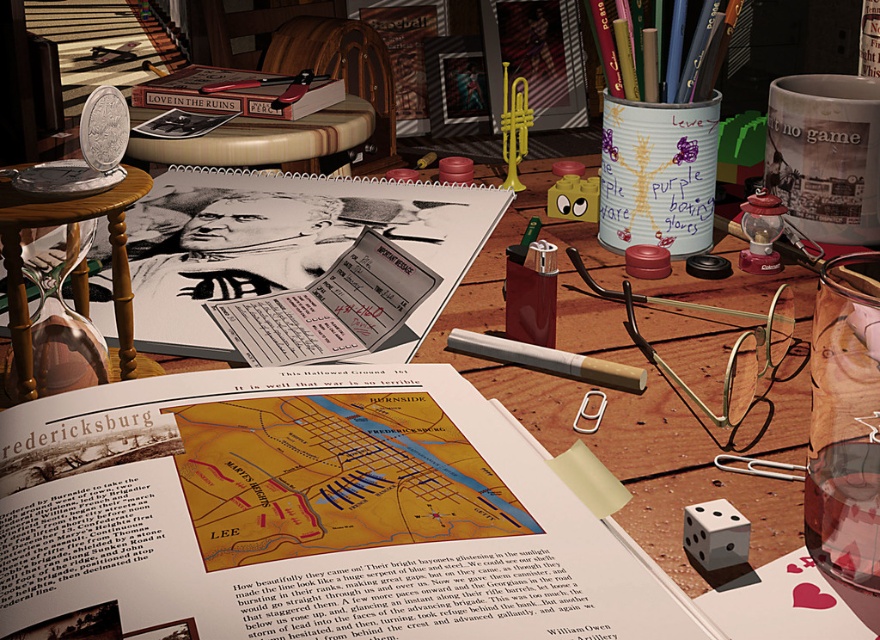
Question: Is wooden table at lower left to the right of matte black book at upper left from the viewer's perspective?

Choices:
 (A) no
 (B) yes

Answer: (B)

Question: Among these points, which one is farthest from the camera?

Choices:
 (A) (257, 93)
 (B) (30, 419)

Answer: (A)

Question: Based on their relative distances, which object is nearer to the matte paper cigarette at center?

Choices:
 (A) matte paper book at center
 (B) shiny burgundy lighter at center
 (C) wooden table at lower left
 (D) metallic pencil case at upper center

Answer: (B)

Question: Which point appears closest to the camera in this image?

Choices:
 (A) (76, 200)
 (B) (213, 93)

Answer: (A)

Question: Can you confirm if hardcover book at upper center is wider than matte black book at upper left?

Choices:
 (A) no
 (B) yes

Answer: (B)

Question: In this image, where is matte paper book at center located relative to wooden table at center?

Choices:
 (A) below
 (B) above

Answer: (A)